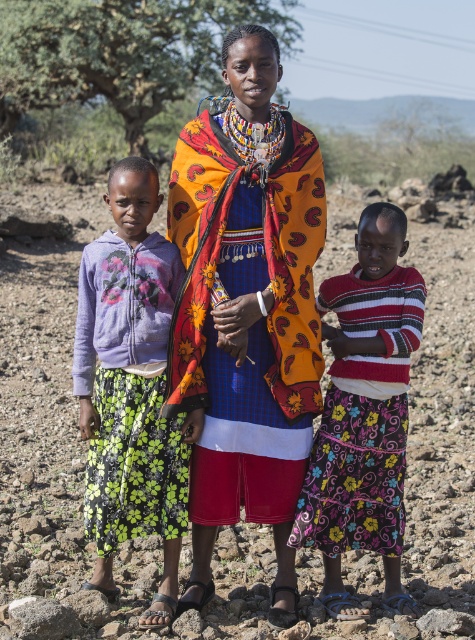
You are a hiker who has just arrived at this rural area. You need to place a 10 feet long tent between the dull brown soil at center and the vibrant woven fabric at center. Is there enough space between them to set up the tent?

The distance between the dull brown soil at center and the vibrant woven fabric at center is 13.93 feet. Since the tent is 10 feet long, there is sufficient space to set it up between them.

You are a photographer trying to capture the vibrant woven fabric at center and the dull brown soil at center in the same frame. Which object should you focus on first if you want to ensure both are in focus?

The dull brown soil at center is taller than vibrant woven fabric at center. To ensure both are in focus, you should focus on the dull brown soil at center first because it is farther away, allowing the vibrant woven fabric at center to fall within the depth of field.